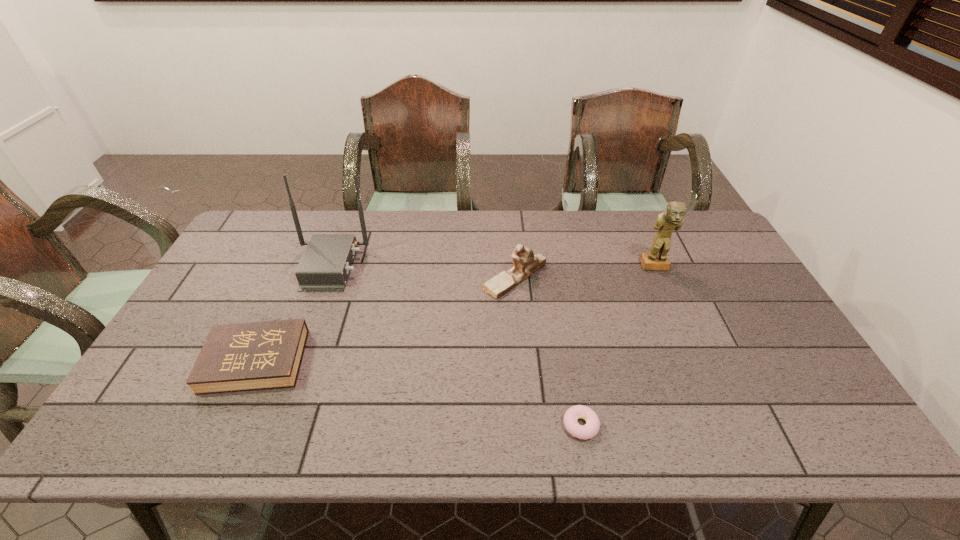
The height and width of the screenshot is (540, 960). I want to click on router, so click(x=326, y=262).

You are a GUI agent. You are given a task and a screenshot of the screen. Output one action in this format:
    pyautogui.click(x=<x>, y=<y>)
    Task: Click on the right figurine
    The image size is (960, 540).
    Given the screenshot: What is the action you would take?
    pyautogui.click(x=672, y=219)

Find the location of a particular element. The height and width of the screenshot is (540, 960). the taller figurine is located at coordinates (672, 219).

Where is `the third shortest object`? the third shortest object is located at coordinates (525, 262).

Where is `the shorter figurine`? The height and width of the screenshot is (540, 960). the shorter figurine is located at coordinates (525, 262).

Locate an element on the screen. The image size is (960, 540). hardback book is located at coordinates (235, 357).

At what (x,y) coordinates should I click in order to perform the action: click on the fourth farthest object. Please return your answer as a coordinate pair (x, y). This screenshot has width=960, height=540. Looking at the image, I should click on click(235, 357).

I want to click on the shortest object, so click(x=592, y=426).

Find the location of a particular element. Image resolution: width=960 pixels, height=540 pixels. the nearest object is located at coordinates (592, 426).

Where is `vacant space located 0.220m on the back of the router to connect cables`? The width and height of the screenshot is (960, 540). vacant space located 0.220m on the back of the router to connect cables is located at coordinates (435, 266).